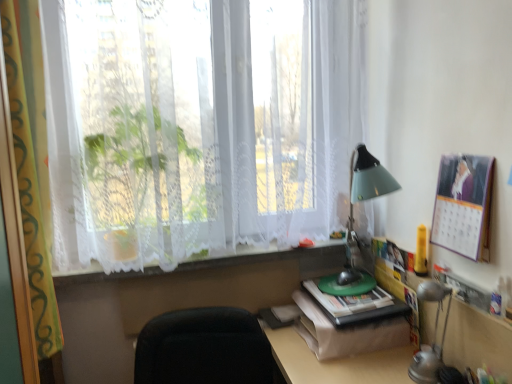
Question: Does metallic silver table lamp at lower right have a lesser width compared to matte paper calendar at upper right?

Choices:
 (A) yes
 (B) no

Answer: (B)

Question: Can matte paper calendar at upper right be found inside metallic silver table lamp at lower right?

Choices:
 (A) no
 (B) yes

Answer: (A)

Question: Is metallic silver table lamp at lower right looking in the opposite direction of matte paper calendar at upper right?

Choices:
 (A) no
 (B) yes

Answer: (A)

Question: Is metallic silver table lamp at lower right to the left of matte paper calendar at upper right from the viewer's perspective?

Choices:
 (A) no
 (B) yes

Answer: (B)

Question: Considering the relative sizes of metallic silver table lamp at lower right and matte paper calendar at upper right in the image provided, is metallic silver table lamp at lower right wider than matte paper calendar at upper right?

Choices:
 (A) no
 (B) yes

Answer: (B)

Question: Is matte paper calendar at upper right to the left or to the right of black fabric chair at lower center in the image?

Choices:
 (A) right
 (B) left

Answer: (A)

Question: In terms of height, does matte paper calendar at upper right look taller or shorter compared to black fabric chair at lower center?

Choices:
 (A) tall
 (B) short

Answer: (B)

Question: From the image's perspective, relative to black fabric chair at lower center, is matte paper calendar at upper right above or below?

Choices:
 (A) above
 (B) below

Answer: (A)

Question: Considering the positions of matte paper calendar at upper right and black fabric chair at lower center in the image, is matte paper calendar at upper right bigger or smaller than black fabric chair at lower center?

Choices:
 (A) big
 (B) small

Answer: (B)

Question: Considering the positions of matte paper calendar at upper right and white lace at center in the image, is matte paper calendar at upper right taller or shorter than white lace at center?

Choices:
 (A) short
 (B) tall

Answer: (B)

Question: Looking at their shapes, would you say matte paper calendar at upper right is wider or thinner than white lace at center?

Choices:
 (A) thin
 (B) wide

Answer: (A)

Question: From the image's perspective, is matte paper calendar at upper right positioned above or below white lace at center?

Choices:
 (A) below
 (B) above

Answer: (B)

Question: From a real-world perspective, is matte paper calendar at upper right above or below white lace at center?

Choices:
 (A) above
 (B) below

Answer: (A)

Question: In the image, is white lace curtain at left on the left side or the right side of white lace curtains at upper center?

Choices:
 (A) left
 (B) right

Answer: (A)

Question: Does point (5, 16) appear closer or farther from the camera than point (333, 69)?

Choices:
 (A) closer
 (B) farther

Answer: (A)